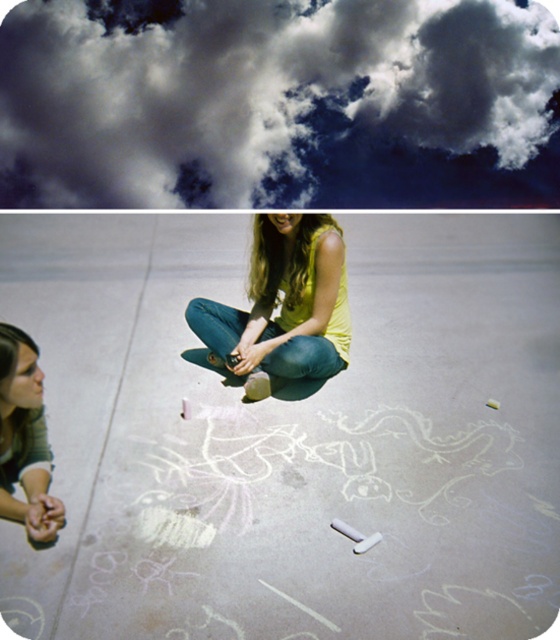
Does smooth concrete pavement at center appear over cloudy sky at upper center?

No.

Between smooth concrete pavement at center and cloudy sky at upper center, which one has more height?

Standing taller between the two is cloudy sky at upper center.

Does point (319, 460) come in front of point (437, 112)?

Yes, it is in front of point (437, 112).

Find the location of a particular element. smooth concrete pavement at center is located at coordinates (291, 436).

Where is `smooth concrete pavement at center`? This screenshot has height=640, width=560. smooth concrete pavement at center is located at coordinates (291, 436).

Which is above, smooth concrete pavement at center or matte yellow shirt at center?

smooth concrete pavement at center is higher up.

Does point (96, 387) lie behind point (21, 416)?

Yes, it is behind point (21, 416).

Find the location of a particular element. Image resolution: width=560 pixels, height=640 pixels. smooth concrete pavement at center is located at coordinates (291, 436).

Consider the image. Does cloudy sky at upper center have a larger size compared to matte yellow shirt at center?

Yes, cloudy sky at upper center is bigger than matte yellow shirt at center.

Can you confirm if cloudy sky at upper center is thinner than matte yellow shirt at center?

No, cloudy sky at upper center is not thinner than matte yellow shirt at center.

Which is behind, point (266, 112) or point (16, 422)?

The point (266, 112) is behind.

Where is `cloudy sky at upper center`? The width and height of the screenshot is (560, 640). cloudy sky at upper center is located at coordinates (278, 104).